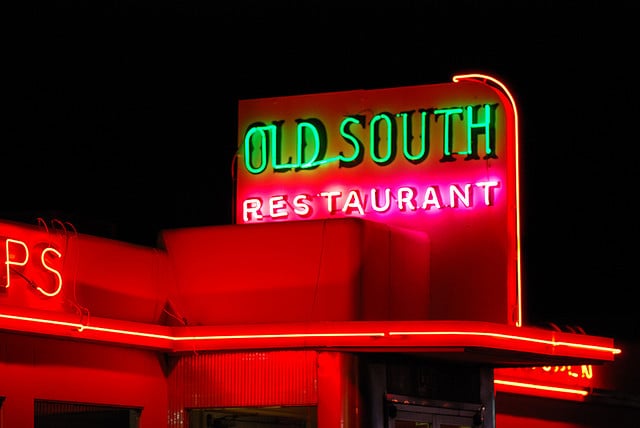
The height and width of the screenshot is (428, 640). What are the coordinates of `window` in the screenshot? It's located at (92, 416).